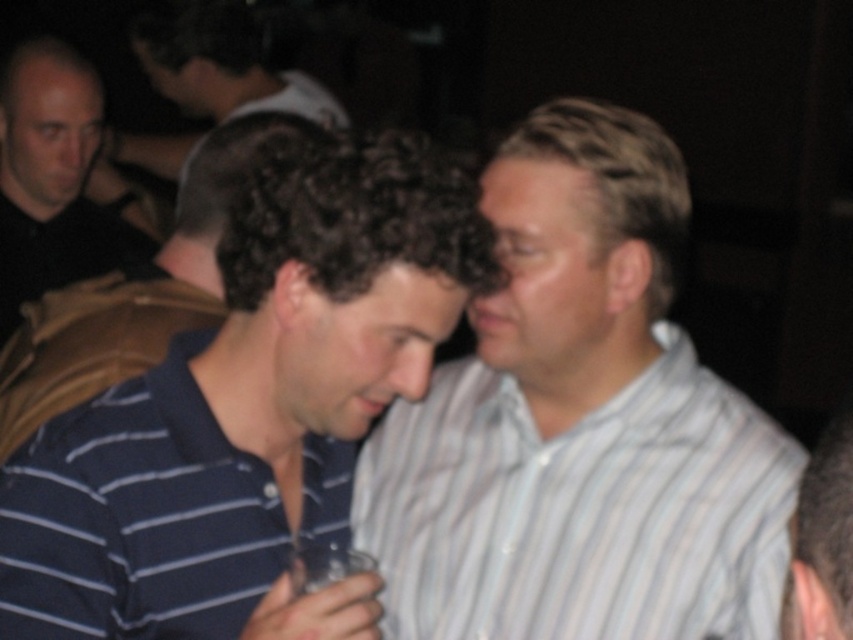
Question: Can you confirm if blue striped shirt at center is positioned to the right of black shirt at left?

Choices:
 (A) no
 (B) yes

Answer: (B)

Question: Can you confirm if black shirt at left is positioned below striped cotton shirt at right?

Choices:
 (A) yes
 (B) no

Answer: (B)

Question: Estimate the real-world distances between objects in this image. Which object is closer to the clear glass wine glass at center?

Choices:
 (A) blue striped polo shirt at center
 (B) dark blue striped polo at center
 (C) blue striped shirt at center

Answer: (B)

Question: Which point is farther from the camera taking this photo?

Choices:
 (A) (177, 49)
 (B) (308, 572)
 (C) (71, 108)
 (D) (833, 476)

Answer: (A)

Question: Which object is the closest to the blue striped polo shirt at center?

Choices:
 (A) blue striped shirt at center
 (B) striped cotton shirt at right
 (C) dark brown hair at upper center
 (D) clear glass wine glass at center

Answer: (A)

Question: From the image, what is the correct spatial relationship of dark blue striped polo at center in relation to striped cotton shirt at right?

Choices:
 (A) left
 (B) right

Answer: (A)